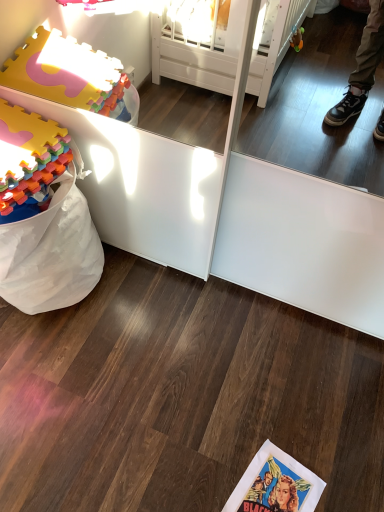
Question: Does matte paper comic book at lower center have a lesser width compared to multicolored foam blocks at left?

Choices:
 (A) yes
 (B) no

Answer: (A)

Question: Is matte paper comic book at lower center wider than multicolored foam blocks at left?

Choices:
 (A) no
 (B) yes

Answer: (A)

Question: Could you tell me if matte paper comic book at lower center is turned towards multicolored foam blocks at left?

Choices:
 (A) yes
 (B) no

Answer: (B)

Question: Is matte paper comic book at lower center outside multicolored foam blocks at left?

Choices:
 (A) no
 (B) yes

Answer: (B)

Question: From a real-world perspective, is matte paper comic book at lower center located higher than multicolored foam blocks at left?

Choices:
 (A) yes
 (B) no

Answer: (B)

Question: Considering the relative sizes of matte paper comic book at lower center and multicolored foam blocks at left in the image provided, is matte paper comic book at lower center taller than multicolored foam blocks at left?

Choices:
 (A) no
 (B) yes

Answer: (A)

Question: From the image's perspective, would you say multicolored foam blocks at left is positioned over matte paper comic book at lower center?

Choices:
 (A) yes
 (B) no

Answer: (A)

Question: Does multicolored foam blocks at left appear on the left side of matte paper comic book at lower center?

Choices:
 (A) yes
 (B) no

Answer: (A)

Question: Considering the relative sizes of multicolored foam blocks at left and matte paper comic book at lower center in the image provided, is multicolored foam blocks at left shorter than matte paper comic book at lower center?

Choices:
 (A) yes
 (B) no

Answer: (B)

Question: Is multicolored foam blocks at left thinner than matte paper comic book at lower center?

Choices:
 (A) no
 (B) yes

Answer: (A)

Question: Does multicolored foam blocks at left lie behind matte paper comic book at lower center?

Choices:
 (A) yes
 (B) no

Answer: (B)

Question: Are multicolored foam blocks at left and matte paper comic book at lower center beside each other?

Choices:
 (A) yes
 (B) no

Answer: (B)

Question: Considering the relative positions of matte paper comic book at lower center and multicolored foam blocks at left in the image provided, is matte paper comic book at lower center to the left or to the right of multicolored foam blocks at left?

Choices:
 (A) left
 (B) right

Answer: (B)